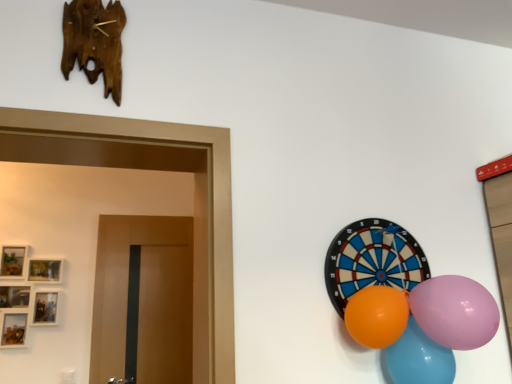
Question: From a real-world perspective, is pink glossy balloon at right, which appears as the second balloon when viewed from the right, beneath rubber balloon at right?

Choices:
 (A) no
 (B) yes

Answer: (B)

Question: Is pink glossy balloon at right, which is counted as the second balloon, starting from the left, far away from rubber balloon at right?

Choices:
 (A) yes
 (B) no

Answer: (B)

Question: Does pink glossy balloon at right, which appears as the second balloon when viewed from the right, turn towards rubber balloon at right?

Choices:
 (A) yes
 (B) no

Answer: (B)

Question: Is pink glossy balloon at right, which is counted as the second balloon, starting from the left, wider than rubber balloon at right?

Choices:
 (A) no
 (B) yes

Answer: (B)

Question: From the image's perspective, is pink glossy balloon at right, which appears as the second balloon when viewed from the right, above rubber balloon at right?

Choices:
 (A) no
 (B) yes

Answer: (A)

Question: Based on their sizes in the image, would you say rubber balloon at right is bigger or smaller than shiny plastic balloons at lower right, acting as the first balloon starting from the right?

Choices:
 (A) big
 (B) small

Answer: (B)

Question: Considering their positions, is rubber balloon at right located in front of or behind shiny plastic balloons at lower right, acting as the first balloon starting from the right?

Choices:
 (A) front
 (B) behind

Answer: (B)

Question: Choose the correct answer: Is rubber balloon at right inside shiny plastic balloons at lower right, acting as the first balloon starting from the right, or outside it?

Choices:
 (A) inside
 (B) outside

Answer: (B)

Question: Would you say rubber balloon at right is to the left or to the right of shiny plastic balloons at lower right, the third balloon from the left, in the picture?

Choices:
 (A) left
 (B) right

Answer: (A)

Question: Looking at the image, does orange rubber balloon at right, the third balloon positioned from the right, seem bigger or smaller compared to rubber balloon at right?

Choices:
 (A) small
 (B) big

Answer: (A)

Question: Is point (367, 317) positioned closer to the camera than point (371, 281)?

Choices:
 (A) farther
 (B) closer

Answer: (B)

Question: From a real-world perspective, is orange rubber balloon at right, the first balloon positioned from the left, positioned above or below rubber balloon at right?

Choices:
 (A) above
 (B) below

Answer: (B)

Question: Do you think orange rubber balloon at right, the first balloon positioned from the left, is within rubber balloon at right, or outside of it?

Choices:
 (A) inside
 (B) outside

Answer: (B)

Question: In terms of size, does pink glossy balloon at right, which is counted as the second balloon, starting from the left, appear bigger or smaller than orange rubber balloon at right, the first balloon positioned from the left?

Choices:
 (A) small
 (B) big

Answer: (B)

Question: In the image, is pink glossy balloon at right, which appears as the second balloon when viewed from the right, positioned in front of or behind orange rubber balloon at right, the first balloon positioned from the left?

Choices:
 (A) front
 (B) behind

Answer: (A)